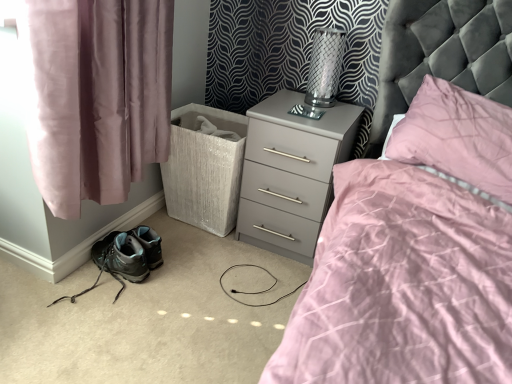
Question: Looking at the image, does matte gray hiking boots at lower left seem bigger or smaller compared to gray matte nightstand at center?

Choices:
 (A) big
 (B) small

Answer: (B)

Question: Is matte gray hiking boots at lower left taller or shorter than gray matte nightstand at center?

Choices:
 (A) short
 (B) tall

Answer: (A)

Question: Which object is the farthest from the pink fabric curtain at left?

Choices:
 (A) gray matte nightstand at center
 (B) pink satin pillow at upper right
 (C) white textured laundry basket at lower left
 (D) matte gray hiking boots at lower left
 (E) metallic mesh table lamp at upper right

Answer: (B)

Question: Which object is the farthest from the white textured laundry basket at lower left?

Choices:
 (A) pink fabric curtain at left
 (B) pink satin pillow at upper right
 (C) matte gray hiking boots at lower left
 (D) metallic mesh table lamp at upper right
 (E) gray matte nightstand at center

Answer: (B)